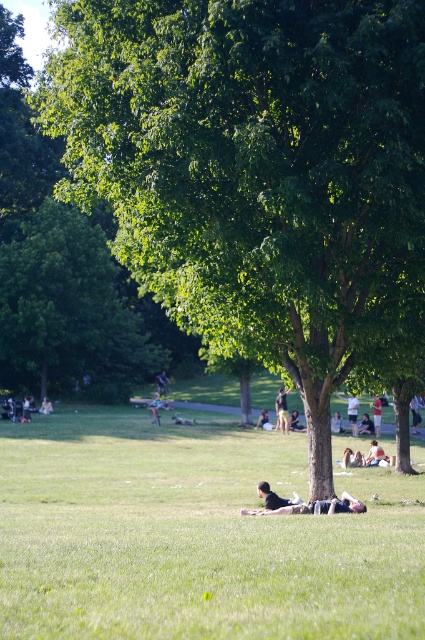
You are standing in the park and want to reach the point marked as point (258, 129). If your walking speed is 1.5 meters per second, how long will it take you to reach that point?

The distance between you and point (258, 129) is 18.49 meters. At a speed of 1.5 meters per second, it will take approximately 12.33 seconds to reach the point.